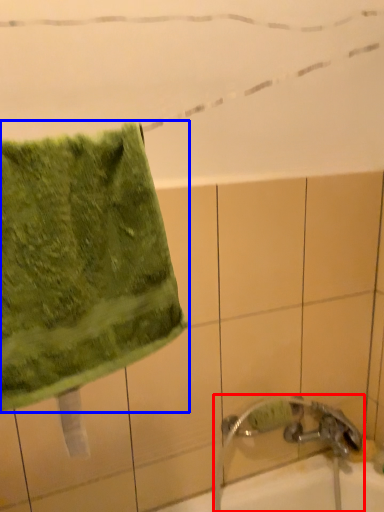
Question: Which point is further to the camera, faucet (highlighted by a red box) or towel (highlighted by a blue box)?

Choices:
 (A) faucet
 (B) towel

Answer: (A)